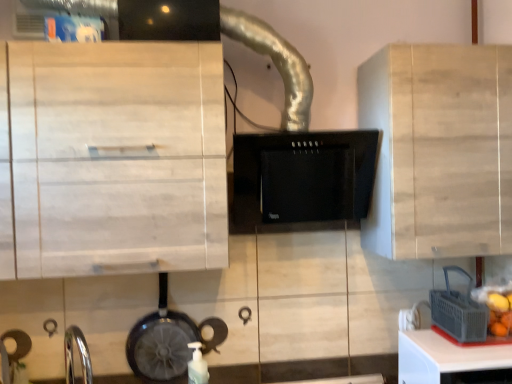
Question: Which is correct: white matte bottle at lower center is inside black matte range hood at center, or outside of it?

Choices:
 (A) outside
 (B) inside

Answer: (A)

Question: From the image's perspective, is white matte bottle at lower center positioned above or below black matte range hood at center?

Choices:
 (A) below
 (B) above

Answer: (A)

Question: Based on their relative distances, which object is farther from the light wood cabinet at center, which is counted as the 2th cabinetry, starting from the left?

Choices:
 (A) light wood cabinet at upper left, which ranks as the second cabinetry in right-to-left order
 (B) white plastic table at lower right
 (C) shiny black frying pan at lower left
 (D) black matte range hood at center
 (E) white matte bottle at lower center

Answer: (E)

Question: Estimate the real-world distances between objects in this image. Which object is closer to the white matte bottle at lower center?

Choices:
 (A) shiny black frying pan at lower left
 (B) light wood cabinet at center, which is counted as the 2th cabinetry, starting from the left
 (C) gray plastic basket at lower right
 (D) black matte range hood at center
 (E) white plastic table at lower right

Answer: (A)